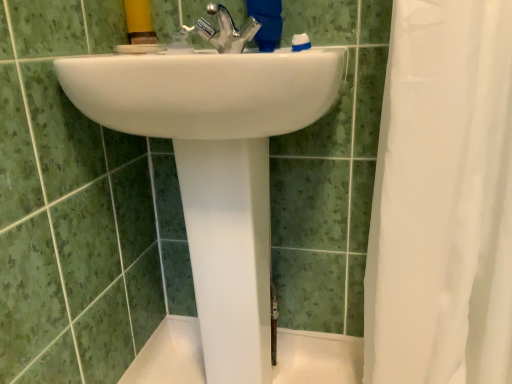
Question: From a real-world perspective, does polished chrome faucet at center stand above white glossy sink at center?

Choices:
 (A) no
 (B) yes

Answer: (B)

Question: Is polished chrome faucet at center with white glossy sink at center?

Choices:
 (A) yes
 (B) no

Answer: (B)

Question: Is polished chrome faucet at center looking in the opposite direction of white glossy sink at center?

Choices:
 (A) no
 (B) yes

Answer: (A)

Question: Is polished chrome faucet at center aimed at white glossy sink at center?

Choices:
 (A) no
 (B) yes

Answer: (A)

Question: Considering the relative positions of polished chrome faucet at center and white glossy sink at center in the image provided, is polished chrome faucet at center to the left of white glossy sink at center from the viewer's perspective?

Choices:
 (A) no
 (B) yes

Answer: (A)

Question: From the image's perspective, does polished chrome faucet at center appear higher than white glossy sink at center?

Choices:
 (A) yes
 (B) no

Answer: (A)

Question: Would you say white glossy sink at center is a long distance from polished chrome faucet at center?

Choices:
 (A) no
 (B) yes

Answer: (A)

Question: Is white glossy sink at center oriented away from polished chrome faucet at center?

Choices:
 (A) yes
 (B) no

Answer: (B)

Question: Is white glossy sink at center to the right of polished chrome faucet at center from the viewer's perspective?

Choices:
 (A) no
 (B) yes

Answer: (A)

Question: Is the position of white glossy sink at center less distant than that of polished chrome faucet at center?

Choices:
 (A) no
 (B) yes

Answer: (B)

Question: Does white glossy sink at center come behind polished chrome faucet at center?

Choices:
 (A) no
 (B) yes

Answer: (A)

Question: Considering the relative sizes of white glossy sink at center and polished chrome faucet at center in the image provided, is white glossy sink at center thinner than polished chrome faucet at center?

Choices:
 (A) yes
 (B) no

Answer: (B)

Question: From a real-world perspective, is white sheer fabric at right located beneath white glossy sink at center?

Choices:
 (A) no
 (B) yes

Answer: (A)